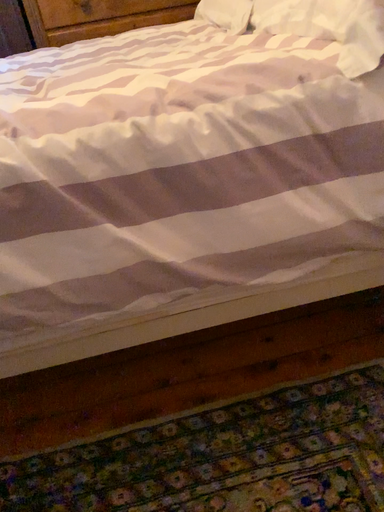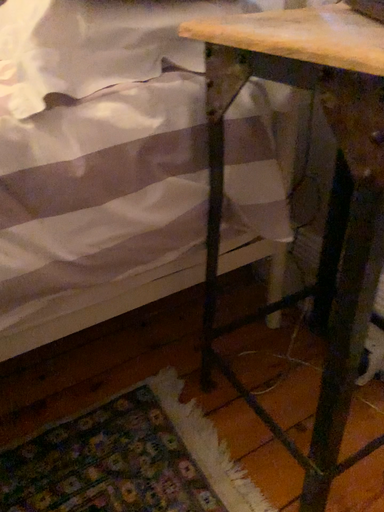
Question: Which way did the camera rotate in the video?

Choices:
 (A) rotated left
 (B) rotated right

Answer: (B)